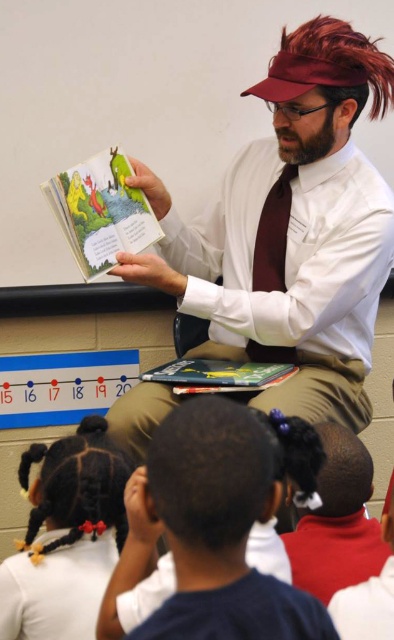
Is white glossy shirt at upper center smaller than maroon satin tie at center?

Incorrect, white glossy shirt at upper center is not smaller in size than maroon satin tie at center.

Between white glossy shirt at upper center and maroon satin tie at center, which one appears on the right side from the viewer's perspective?

Positioned to the right is maroon satin tie at center.

The height and width of the screenshot is (640, 394). Identify the location of white glossy shirt at upper center. (291, 230).

I want to click on white glossy shirt at upper center, so (291, 230).

Does black hair at lower center appear on the left side of black braided hair at lower left?

In fact, black hair at lower center is to the right of black braided hair at lower left.

The image size is (394, 640). Identify the location of black hair at lower center. (213, 529).

Describe the element at coordinates (213, 529) in the screenshot. I see `black hair at lower center` at that location.

Identify the location of black hair at lower center. Image resolution: width=394 pixels, height=640 pixels. (213, 529).

What do you see at coordinates (66, 536) in the screenshot?
I see `black braided hair at lower left` at bounding box center [66, 536].

Does point (33, 515) come closer to viewer compared to point (156, 220)?

That is True.

This screenshot has height=640, width=394. What are the coordinates of `black braided hair at lower left` in the screenshot? It's located at (66, 536).